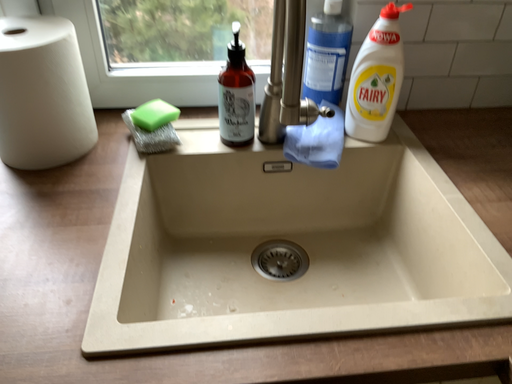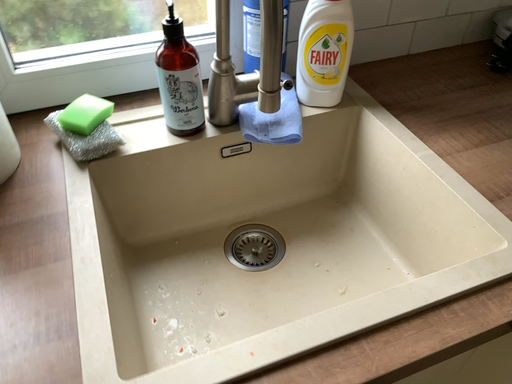
Question: How did the camera likely rotate when shooting the video?

Choices:
 (A) rotated right
 (B) rotated left

Answer: (A)